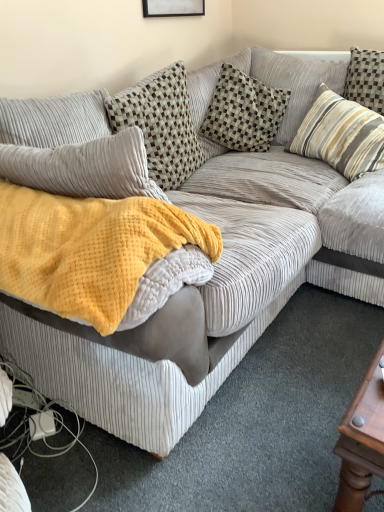
This screenshot has width=384, height=512. In order to click on striped fabric pillow at upper right, which is counted as the 1th pillow, starting from the right in this screenshot , I will do `click(341, 135)`.

This screenshot has height=512, width=384. In order to click on yellow waffle knit blanket at center in this screenshot , I will do `click(89, 250)`.

Is checkered fabric pillow at upper left, positioned as the 3th pillow in right-to-left order, looking in the opposite direction of striped fabric pillow at upper right, the third pillow in the left-to-right sequence?

checkered fabric pillow at upper left, positioned as the 3th pillow in right-to-left order, is not turned away from striped fabric pillow at upper right, the third pillow in the left-to-right sequence.

Between checkered fabric pillow at upper left, marked as the first pillow in a left-to-right arrangement, and striped fabric pillow at upper right, the third pillow in the left-to-right sequence, which one appears on the left side from the viewer's perspective?

checkered fabric pillow at upper left, marked as the first pillow in a left-to-right arrangement.

Are checkered fabric pillow at upper left, marked as the first pillow in a left-to-right arrangement, and striped fabric pillow at upper right, the third pillow in the left-to-right sequence, making contact?

Answer: They are not placed beside each other.

Is point (151, 148) positioned before point (373, 133)?

Yes, point (151, 148) is in front of point (373, 133).

From a real-world perspective, who is located lower, striped fabric pillow at upper right, the third pillow in the left-to-right sequence, or checkered fabric pillow at upper left, positioned as the 3th pillow in right-to-left order?

In real-world perspective, striped fabric pillow at upper right, the third pillow in the left-to-right sequence, is lower.

Which point is more distant from viewer, [356,115] or [154,160]?

The point [356,115] is behind.

Is striped fabric pillow at upper right, the third pillow in the left-to-right sequence, next to checkered fabric pillow at upper left, positioned as the 3th pillow in right-to-left order?

No, striped fabric pillow at upper right, the third pillow in the left-to-right sequence, is not touching checkered fabric pillow at upper left, positioned as the 3th pillow in right-to-left order.

Find the location of a particular element. The image size is (384, 512). the 2nd pillow to the left of the striped fabric pillow at upper right, the third pillow in the left-to-right sequence, starting your count from the anchor is located at coordinates [161, 125].

How many degrees apart are the facing directions of yellow waffle knit blanket at center and striped fabric pillow at upper right, the third pillow in the left-to-right sequence?

106 degrees separate the facing orientations of yellow waffle knit blanket at center and striped fabric pillow at upper right, the third pillow in the left-to-right sequence.

From the image's perspective, which is below, yellow waffle knit blanket at center or striped fabric pillow at upper right, the third pillow in the left-to-right sequence?

yellow waffle knit blanket at center, from the image's perspective.

Relative to striped fabric pillow at upper right, which is counted as the 1th pillow, starting from the right, is yellow waffle knit blanket at center in front or behind?

yellow waffle knit blanket at center is in front of striped fabric pillow at upper right, which is counted as the 1th pillow, starting from the right.

Is yellow waffle knit blanket at center thinner than striped fabric pillow at upper right, the third pillow in the left-to-right sequence?

In fact, yellow waffle knit blanket at center might be wider than striped fabric pillow at upper right, the third pillow in the left-to-right sequence.

Is checkered fabric pillow at upper left, marked as the first pillow in a left-to-right arrangement, not within yellow waffle knit blanket at center?

That's correct, checkered fabric pillow at upper left, marked as the first pillow in a left-to-right arrangement, is outside of yellow waffle knit blanket at center.

From the picture: Which is nearer, (148, 103) or (168, 228)?

Point (148, 103) is positioned farther from the camera compared to point (168, 228).

Considering the sizes of objects checkered fabric pillow at upper left, positioned as the 3th pillow in right-to-left order, and yellow waffle knit blanket at center in the image provided, who is smaller, checkered fabric pillow at upper left, positioned as the 3th pillow in right-to-left order, or yellow waffle knit blanket at center?

With smaller size is checkered fabric pillow at upper left, positioned as the 3th pillow in right-to-left order.

Between checkered fabric pillow at center, placed as the 2th pillow when sorted from left to right, and striped fabric pillow at upper right, which is counted as the 1th pillow, starting from the right, which one has smaller size?

With smaller size is checkered fabric pillow at center, placed as the 2th pillow when sorted from left to right.

From the picture: From a real-world perspective, who is located lower, checkered fabric pillow at center, the second pillow in the right-to-left sequence, or striped fabric pillow at upper right, the third pillow in the left-to-right sequence?

striped fabric pillow at upper right, the third pillow in the left-to-right sequence, from a real-world perspective.

Is checkered fabric pillow at center, the second pillow in the right-to-left sequence, beside striped fabric pillow at upper right, which is counted as the 1th pillow, starting from the right?

No, checkered fabric pillow at center, the second pillow in the right-to-left sequence, is not next to striped fabric pillow at upper right, which is counted as the 1th pillow, starting from the right.

Considering the relative positions of checkered fabric pillow at center, placed as the 2th pillow when sorted from left to right, and striped fabric pillow at upper right, the third pillow in the left-to-right sequence, in the image provided, is checkered fabric pillow at center, placed as the 2th pillow when sorted from left to right, to the right of striped fabric pillow at upper right, the third pillow in the left-to-right sequence, from the viewer's perspective?

In fact, checkered fabric pillow at center, placed as the 2th pillow when sorted from left to right, is to the left of striped fabric pillow at upper right, the third pillow in the left-to-right sequence.

Considering the sizes of yellow waffle knit blanket at center and checkered fabric pillow at upper left, positioned as the 3th pillow in right-to-left order, in the image, is yellow waffle knit blanket at center taller or shorter than checkered fabric pillow at upper left, positioned as the 3th pillow in right-to-left order,?

Clearly, yellow waffle knit blanket at center is shorter compared to checkered fabric pillow at upper left, positioned as the 3th pillow in right-to-left order.

Consider the image. From a real-world perspective, is yellow waffle knit blanket at center above or below checkered fabric pillow at upper left, marked as the first pillow in a left-to-right arrangement?

yellow waffle knit blanket at center is situated higher than checkered fabric pillow at upper left, marked as the first pillow in a left-to-right arrangement, in the real world.

Is point (98, 294) in front of point (166, 190)?

Yes, it is.

Between striped fabric pillow at upper right, the third pillow in the left-to-right sequence, and yellow waffle knit blanket at center, which one has larger width?

yellow waffle knit blanket at center.

From a real-world perspective, relative to yellow waffle knit blanket at center, is striped fabric pillow at upper right, which is counted as the 1th pillow, starting from the right, vertically above or below?

striped fabric pillow at upper right, which is counted as the 1th pillow, starting from the right, is below yellow waffle knit blanket at center.

Is striped fabric pillow at upper right, the third pillow in the left-to-right sequence, touching yellow waffle knit blanket at center?

No, striped fabric pillow at upper right, the third pillow in the left-to-right sequence, is not making contact with yellow waffle knit blanket at center.

Considering the positions of objects striped fabric pillow at upper right, which is counted as the 1th pillow, starting from the right, and yellow waffle knit blanket at center in the image provided, who is more to the right, striped fabric pillow at upper right, which is counted as the 1th pillow, starting from the right, or yellow waffle knit blanket at center?

striped fabric pillow at upper right, which is counted as the 1th pillow, starting from the right.

The width and height of the screenshot is (384, 512). In order to click on the 1st pillow behind when counting from the checkered fabric pillow at upper left, marked as the first pillow in a left-to-right arrangement in this screenshot , I will do `click(341, 135)`.

There is a checkered fabric pillow at upper left, marked as the first pillow in a left-to-right arrangement. Identify the location of the 1st pillow above it (from the image's perspective). Image resolution: width=384 pixels, height=512 pixels. (341, 135).

From the image, which object appears to be nearer to yellow waffle knit blanket at center, checkered fabric pillow at upper left, marked as the first pillow in a left-to-right arrangement, or striped fabric pillow at upper right, the third pillow in the left-to-right sequence?

checkered fabric pillow at upper left, marked as the first pillow in a left-to-right arrangement, is positioned closer to the anchor yellow waffle knit blanket at center.

Consider the image. Looking at the image, which one is located closer to yellow waffle knit blanket at center, checkered fabric pillow at upper left, positioned as the 3th pillow in right-to-left order, or checkered fabric pillow at center, the second pillow in the right-to-left sequence?

checkered fabric pillow at upper left, positioned as the 3th pillow in right-to-left order, is positioned closer to the anchor yellow waffle knit blanket at center.

Which object lies nearer to the anchor point checkered fabric pillow at center, the second pillow in the right-to-left sequence, yellow waffle knit blanket at center or striped fabric pillow at upper right, which is counted as the 1th pillow, starting from the right?

The object closer to checkered fabric pillow at center, the second pillow in the right-to-left sequence, is striped fabric pillow at upper right, which is counted as the 1th pillow, starting from the right.

From the image, which object appears to be farther from striped fabric pillow at upper right, which is counted as the 1th pillow, starting from the right, checkered fabric pillow at upper left, marked as the first pillow in a left-to-right arrangement, or yellow waffle knit blanket at center?

yellow waffle knit blanket at center is further to striped fabric pillow at upper right, which is counted as the 1th pillow, starting from the right.

Estimate the real-world distances between objects in this image. Which object is closer to checkered fabric pillow at center, the second pillow in the right-to-left sequence, yellow waffle knit blanket at center or checkered fabric pillow at upper left, marked as the first pillow in a left-to-right arrangement?

Among the two, checkered fabric pillow at upper left, marked as the first pillow in a left-to-right arrangement, is located nearer to checkered fabric pillow at center, the second pillow in the right-to-left sequence.

Estimate the real-world distances between objects in this image. Which object is further from checkered fabric pillow at upper left, positioned as the 3th pillow in right-to-left order, checkered fabric pillow at center, placed as the 2th pillow when sorted from left to right, or striped fabric pillow at upper right, which is counted as the 1th pillow, starting from the right?

striped fabric pillow at upper right, which is counted as the 1th pillow, starting from the right, lies further to checkered fabric pillow at upper left, positioned as the 3th pillow in right-to-left order, than the other object.

When comparing their distances from checkered fabric pillow at upper left, marked as the first pillow in a left-to-right arrangement, does yellow waffle knit blanket at center or striped fabric pillow at upper right, which is counted as the 1th pillow, starting from the right, seem closer?

Among the two, striped fabric pillow at upper right, which is counted as the 1th pillow, starting from the right, is located nearer to checkered fabric pillow at upper left, marked as the first pillow in a left-to-right arrangement.

Considering their positions, is checkered fabric pillow at upper left, positioned as the 3th pillow in right-to-left order, positioned further to checkered fabric pillow at center, placed as the 2th pillow when sorted from left to right, than striped fabric pillow at upper right, which is counted as the 1th pillow, starting from the right?

checkered fabric pillow at upper left, positioned as the 3th pillow in right-to-left order, is positioned further to the anchor checkered fabric pillow at center, placed as the 2th pillow when sorted from left to right.

Locate an element on the screen. The width and height of the screenshot is (384, 512). pillow between checkered fabric pillow at upper left, positioned as the 3th pillow in right-to-left order, and striped fabric pillow at upper right, the third pillow in the left-to-right sequence, in the horizontal direction is located at coordinates pyautogui.click(x=243, y=112).